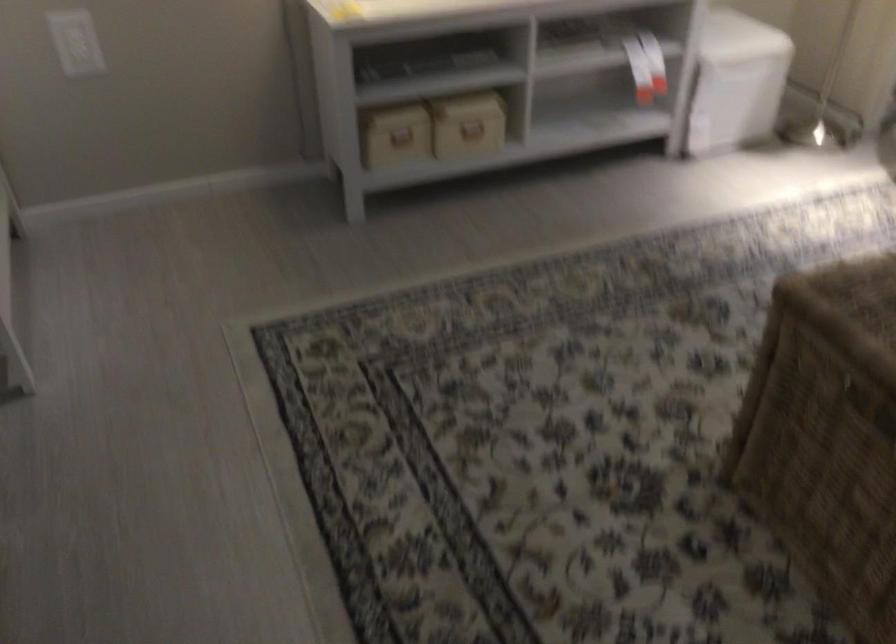
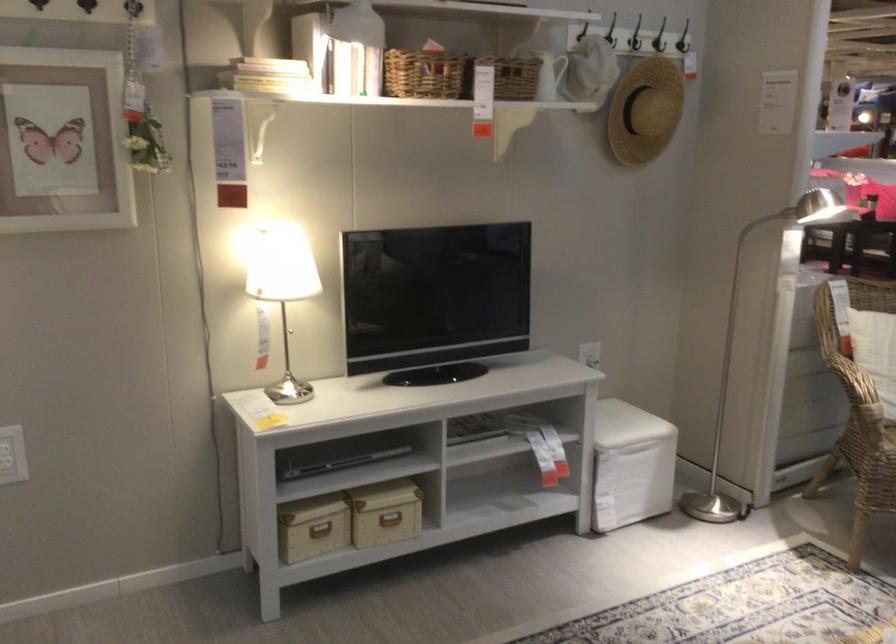
Question: The first image is from the beginning of the video and the second image is from the end. How did the camera likely rotate when shooting the video?

Choices:
 (A) Left
 (B) Right
 (C) Up
 (D) Down

Answer: (C)